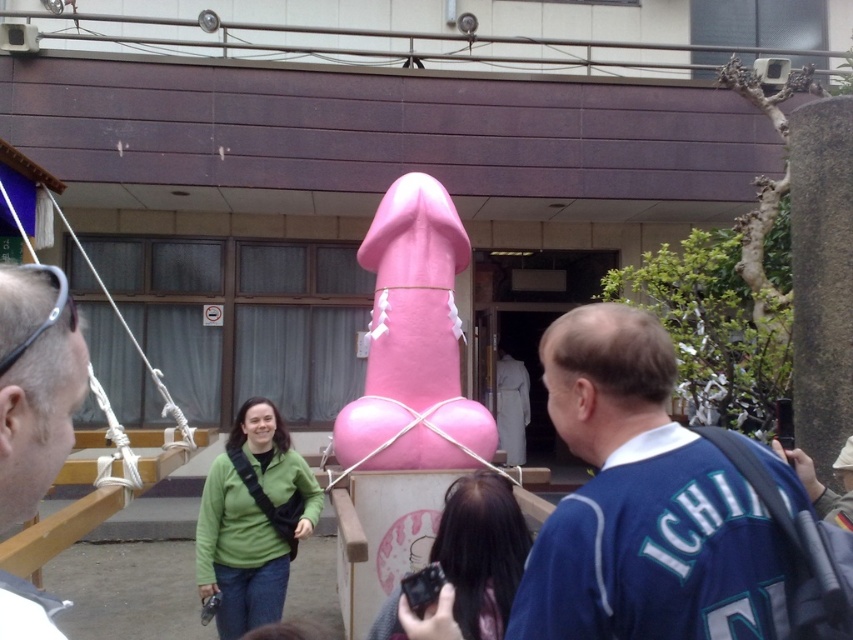
You are standing in front of the large pink sculpture and want to take a photo of the point at coordinates (358,253). If your camera has a maximum focus range of 20 feet, will you be able to focus on that point?

The point at coordinates (358,253) is 22.07 feet away from you, which exceeds your camera maximum focus range of 20 feet. Therefore, you won not be able to focus on that point.

From the picture: You are a photographer trying to capture both the matte black sunglasses at left and the green fabric jacket at center in a single frame. Based on their positions, which object should you focus on first to ensure both are in the shot?

Since the matte black sunglasses at left is to the left of green fabric jacket at center, you should focus on the green fabric jacket at center first to ensure both are in the shot.

You are standing in front of the sculpture and see a person wearing a blue jersey at center and another wearing a green matte jacket at center. Which one is positioned more to the right side?

The blue jersey at center is positioned to the right of the green matte jacket at center, so the blue jersey at center is more to the right side.